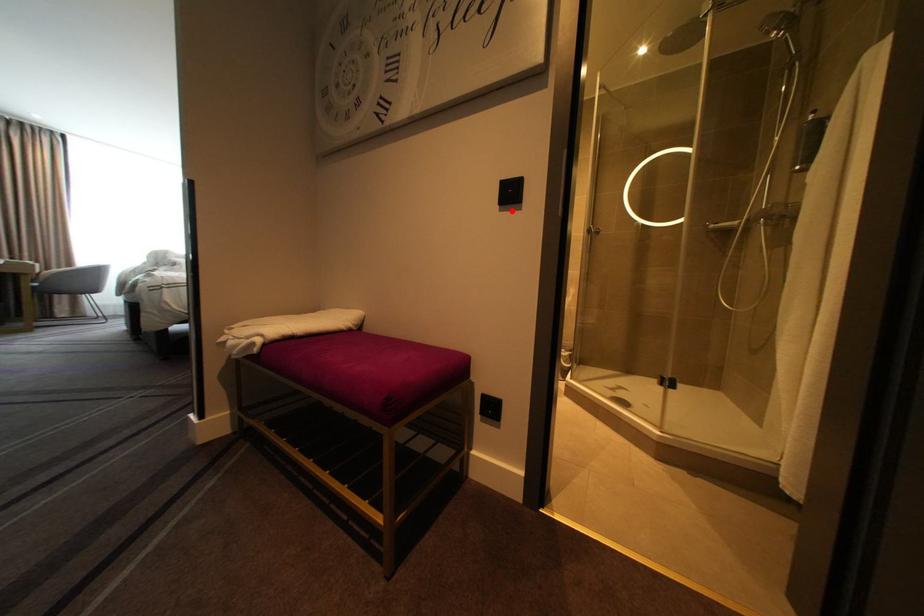
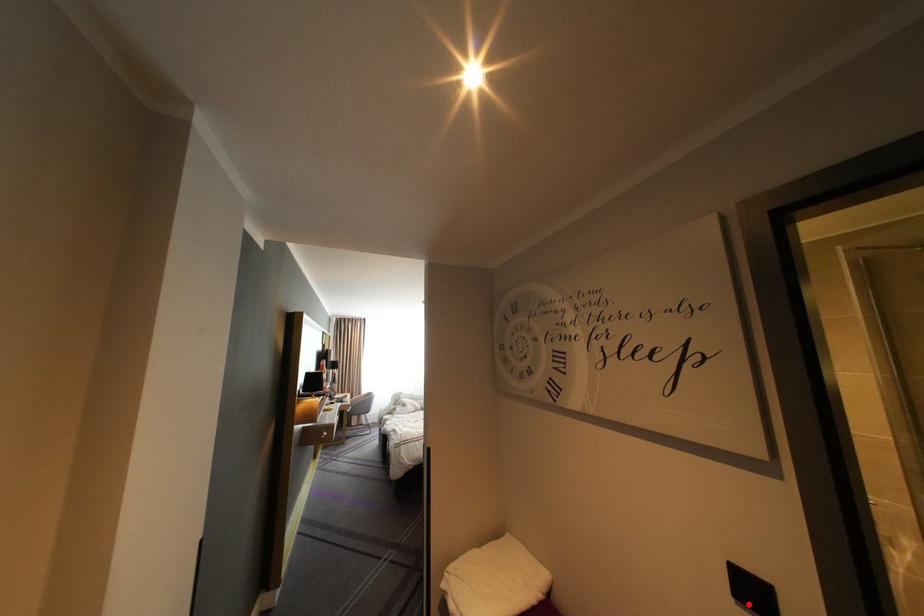
I am providing you with two images of the same scene from different viewpoints. A red point is marked on the first image and another point is marked on the second image. Do the highlighted points in image1 and image2 indicate the same real-world spot?

Yes